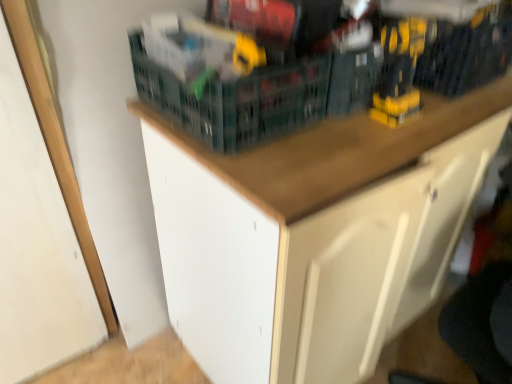
Where is `free space in front of green plastic basket at upper center`? The image size is (512, 384). free space in front of green plastic basket at upper center is located at coordinates (279, 167).